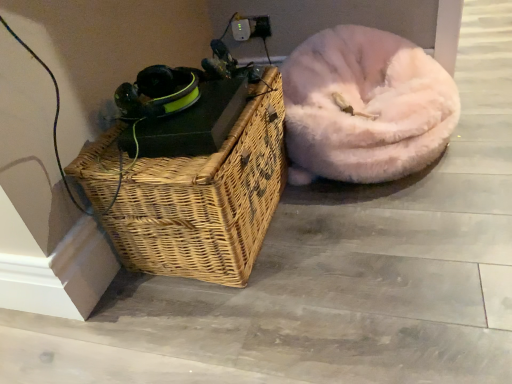
Locate an element on the screen. vacant space in front of woven wood picnic basket at lower left is located at coordinates point(258,324).